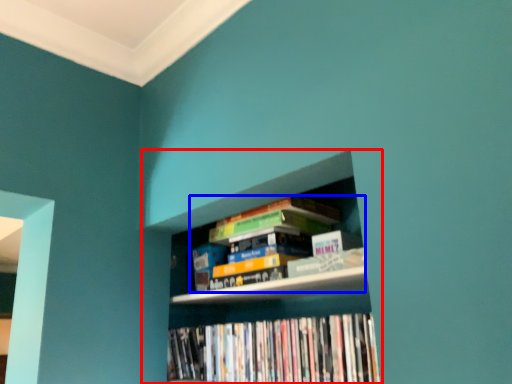
Question: Which object appears closest to the camera in this image, bookcase (highlighted by a red box) or book (highlighted by a blue box)?

Choices:
 (A) bookcase
 (B) book

Answer: (A)